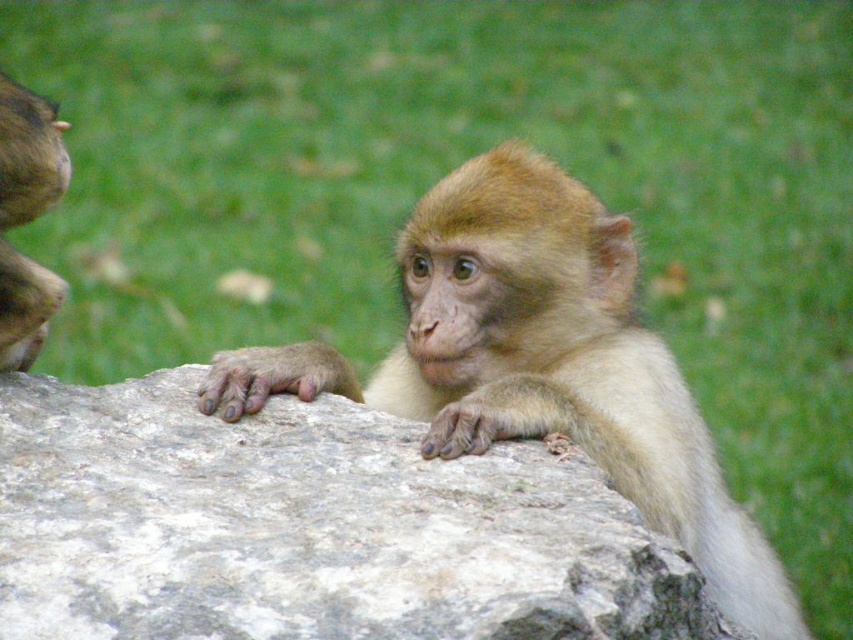
Question: Which object is the closest to the gray rough rock at center?

Choices:
 (A) golden fur monkey at left
 (B) fuzzy brown monkey at center

Answer: (B)

Question: Does gray rough rock at center have a smaller size compared to golden fur monkey at left?

Choices:
 (A) no
 (B) yes

Answer: (A)

Question: Is the position of fuzzy brown monkey at center less distant than that of golden fur monkey at left?

Choices:
 (A) no
 (B) yes

Answer: (B)

Question: Which point is farther from the camera taking this photo?

Choices:
 (A) pyautogui.click(x=454, y=380)
 (B) pyautogui.click(x=25, y=216)
 (C) pyautogui.click(x=53, y=465)

Answer: (A)

Question: Which point is closer to the camera taking this photo?

Choices:
 (A) (3, 99)
 (B) (674, 506)
 (C) (409, 484)

Answer: (C)

Question: Can you confirm if fuzzy brown monkey at center is positioned to the left of golden fur monkey at left?

Choices:
 (A) no
 (B) yes

Answer: (A)